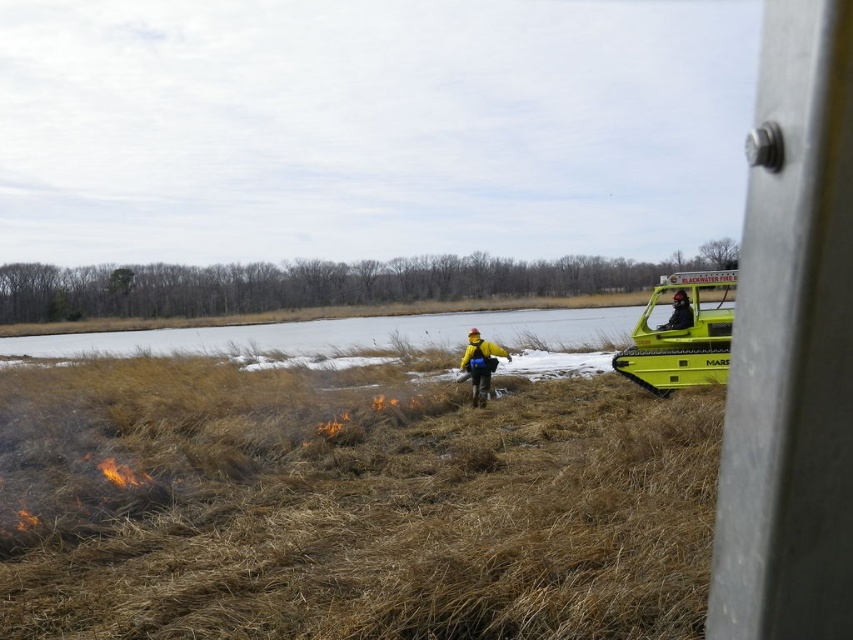
You are a firefighter observing the controlled burn in the marshy area. You notice the brown dry grass at center and the black matte helmet at center. Which object is closer to the ground?

The brown dry grass at center is positioned under the black matte helmet at center, so the brown dry grass at center is closer to the ground.

You are standing near the brown dry grass at center and want to move to a safe area 5 meters away. Can you walk directly away from the grass to reach safety?

The distance between you and the brown dry grass at center is 3.52 meters. Since you need to be 5 meters away for safety, you need to move an additional 1.48 meters away from the grass.